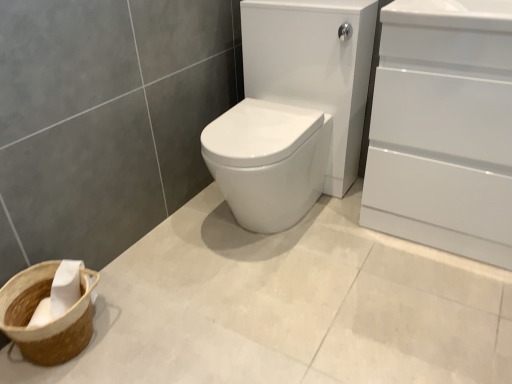
Question: Considering the relative positions of white glossy sink at center and white glossy cabinet at right in the image provided, is white glossy sink at center to the left or to the right of white glossy cabinet at right?

Choices:
 (A) left
 (B) right

Answer: (A)

Question: Is point (326, 135) positioned closer to the camera than point (392, 26)?

Choices:
 (A) farther
 (B) closer

Answer: (A)

Question: Estimate the real-world distances between objects in this image. Which object is closer to the brown woven basket at lower left?

Choices:
 (A) white glossy sink at center
 (B) white glossy cabinet at right

Answer: (A)

Question: Based on their relative distances, which object is farther from the white glossy cabinet at right?

Choices:
 (A) white glossy sink at center
 (B) brown woven basket at lower left

Answer: (B)